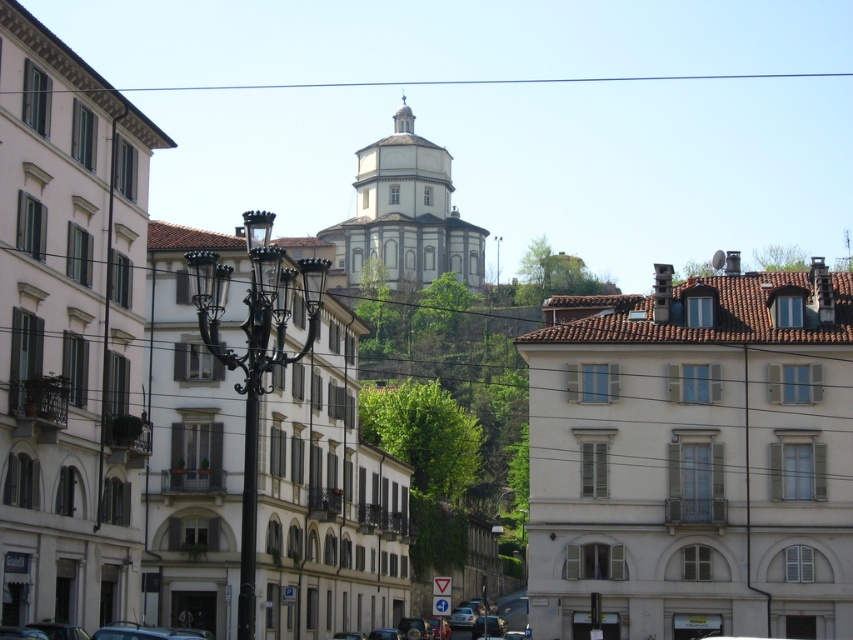
The image size is (853, 640). Describe the element at coordinates (693, 458) in the screenshot. I see `white tiled roof at upper center` at that location.

Is point (795, 548) farther from camera compared to point (299, 620)?

No.

The image size is (853, 640). In order to click on white tiled roof at upper center in this screenshot , I will do `click(693, 458)`.

This screenshot has height=640, width=853. What are the coordinates of `white tiled roof at upper center` in the screenshot? It's located at (693, 458).

Can you confirm if white smooth dome at center is positioned above metallic silver car at center?

Correct, white smooth dome at center is located above metallic silver car at center.

Who is higher up, white smooth dome at center or metallic silver car at center?

Positioned higher is white smooth dome at center.

What do you see at coordinates (405, 214) in the screenshot? I see `white smooth dome at center` at bounding box center [405, 214].

Locate an element on the screen. The width and height of the screenshot is (853, 640). white smooth dome at center is located at coordinates click(x=405, y=214).

Does white stone church at center appear on the left side of metallic silver car at center?

Indeed, white stone church at center is positioned on the left side of metallic silver car at center.

Is white stone church at center shorter than metallic silver car at center?

No, white stone church at center is not shorter than metallic silver car at center.

Locate an element on the screen. The width and height of the screenshot is (853, 640). white stone church at center is located at coordinates (68, 332).